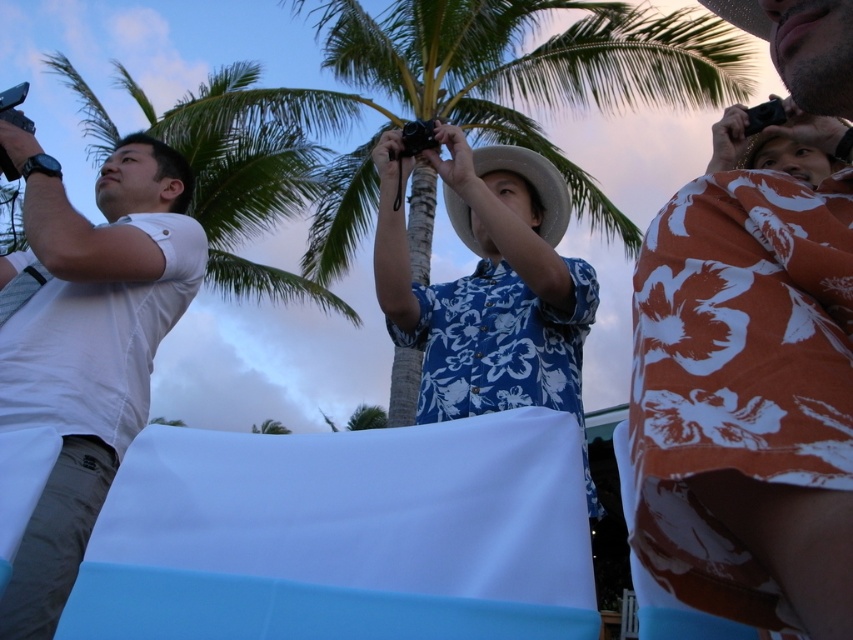
Consider the image. Does green leafy palm tree at center lie in front of white matte shirt at left?

No.

Who is more forward, (654, 22) or (79, 316)?

Point (79, 316) is in front.

Which is behind, point (521, 88) or point (67, 342)?

The point (521, 88) is behind.

The height and width of the screenshot is (640, 853). I want to click on green leafy palm tree at center, so click(514, 72).

From the picture: Can you confirm if green leafy palm tree at center is positioned to the left of green leafy palm tree at left?

In fact, green leafy palm tree at center is to the right of green leafy palm tree at left.

In the scene shown: Which is more to the left, green leafy palm tree at center or green leafy palm tree at left?

green leafy palm tree at left is more to the left.

Which is behind, point (402, 371) or point (296, 166)?

The point (296, 166) is more distant.

Locate an element on the screen. The width and height of the screenshot is (853, 640). green leafy palm tree at center is located at coordinates (514, 72).

Image resolution: width=853 pixels, height=640 pixels. I want to click on floral orange shirt at center, so click(x=747, y=396).

Which is more to the left, floral orange shirt at center or green leafy palm tree at center?

Positioned to the left is floral orange shirt at center.

Who is more distant from viewer, (804, 320) or (381, 72)?

The point (381, 72) is behind.

The height and width of the screenshot is (640, 853). Find the location of `floral orange shirt at center`. floral orange shirt at center is located at coordinates (747, 396).